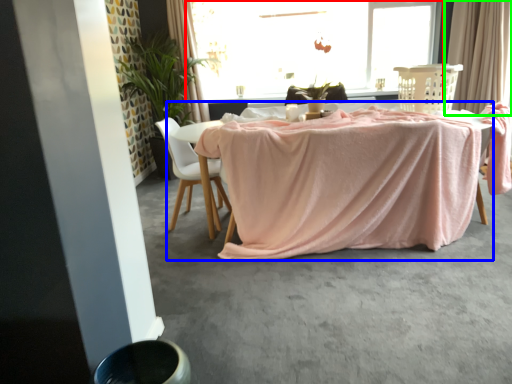
Question: Which is nearer to the window (highlighted by a red box)? table (highlighted by a blue box) or curtain (highlighted by a green box).

Choices:
 (A) table
 (B) curtain

Answer: (B)